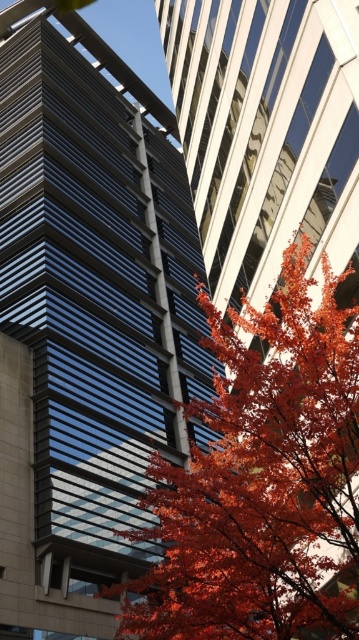
What are the coordinates of `smooth glass tower at center` in the screenshot? It's located at (86, 317).

Does point (11, 250) lie behind point (283, 362)?

Yes, it is behind point (283, 362).

This screenshot has width=359, height=640. Find the location of `smooth glass tower at center`. smooth glass tower at center is located at coordinates (86, 317).

Identify the location of smooth glass tower at center. (86, 317).